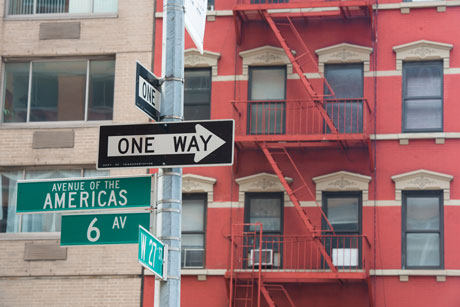
Where is `wall`? This screenshot has width=460, height=307. wall is located at coordinates (309, 168).